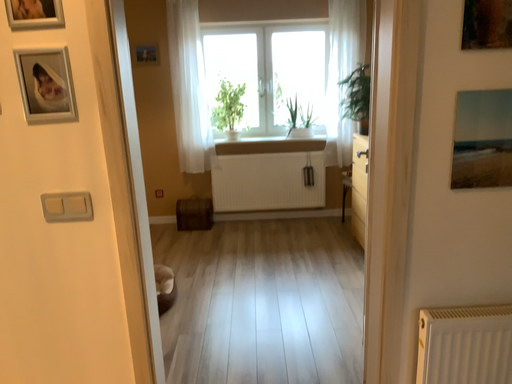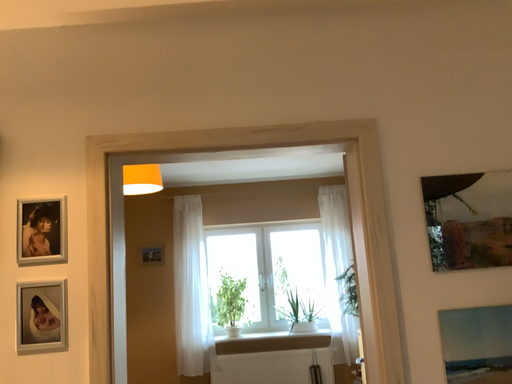
Question: Which way did the camera rotate in the video?

Choices:
 (A) rotated upward
 (B) rotated downward

Answer: (A)